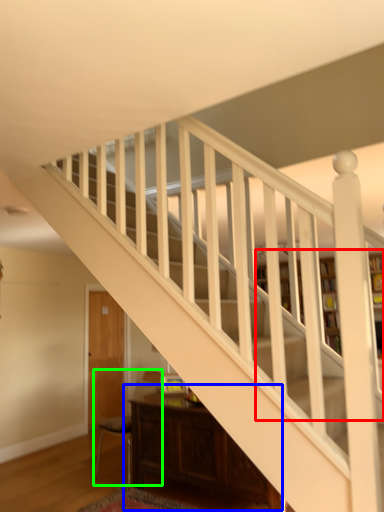
Question: Which is nearer to the bookcase (highlighted by a red box)? table (highlighted by a blue box) or armchair (highlighted by a green box).

Choices:
 (A) table
 (B) armchair

Answer: (A)